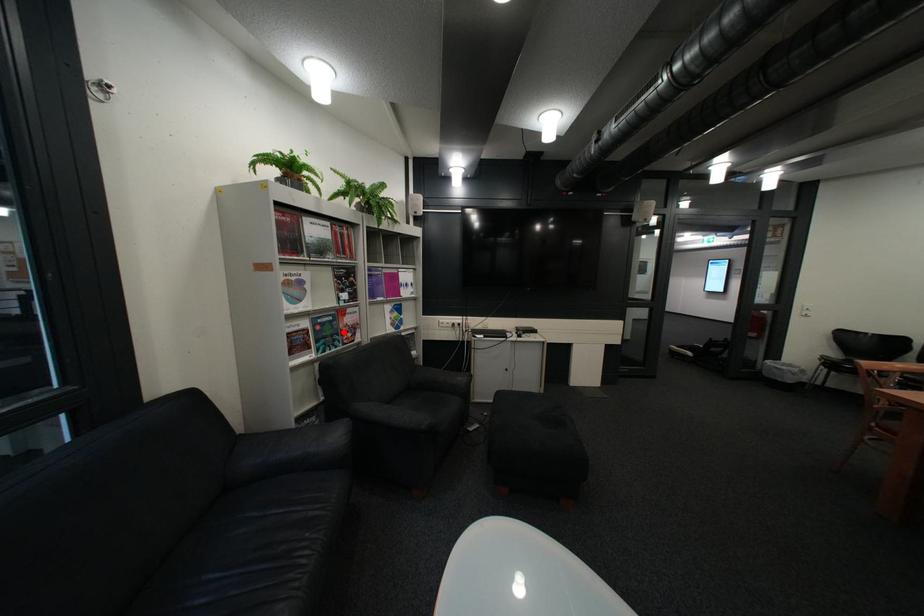
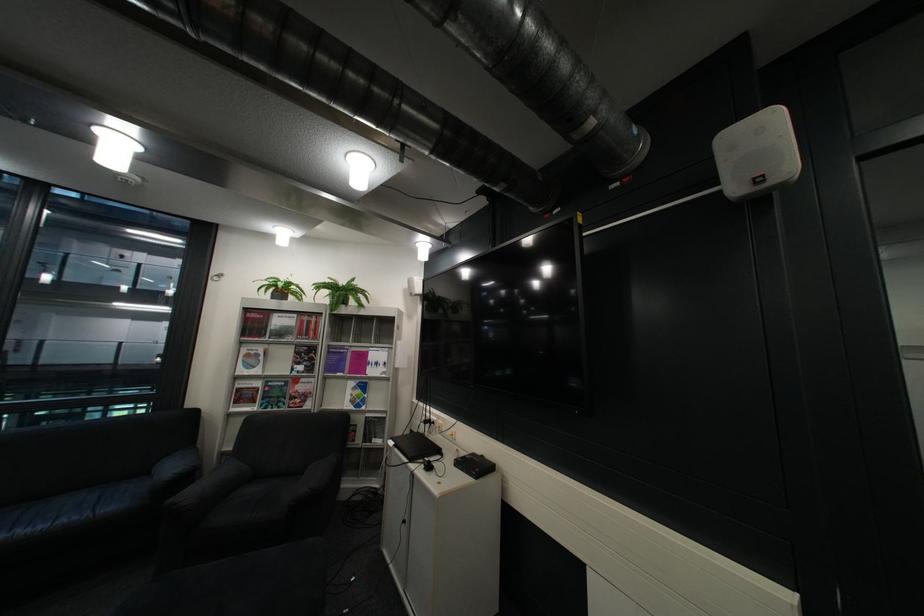
The point at the highlighted location is marked in the first image. Where is the corresponding point in the second image?

(290, 394)